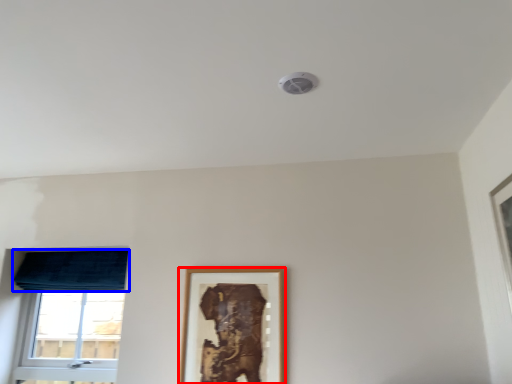
Question: Which object appears closest to the camera in this image, picture frame (highlighted by a red box) or curtain (highlighted by a blue box)?

Choices:
 (A) picture frame
 (B) curtain

Answer: (A)